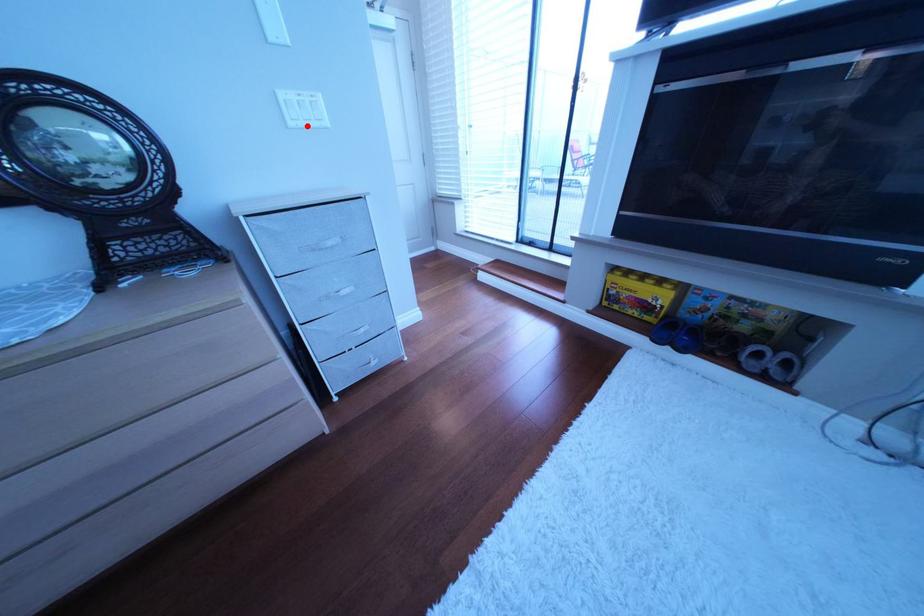
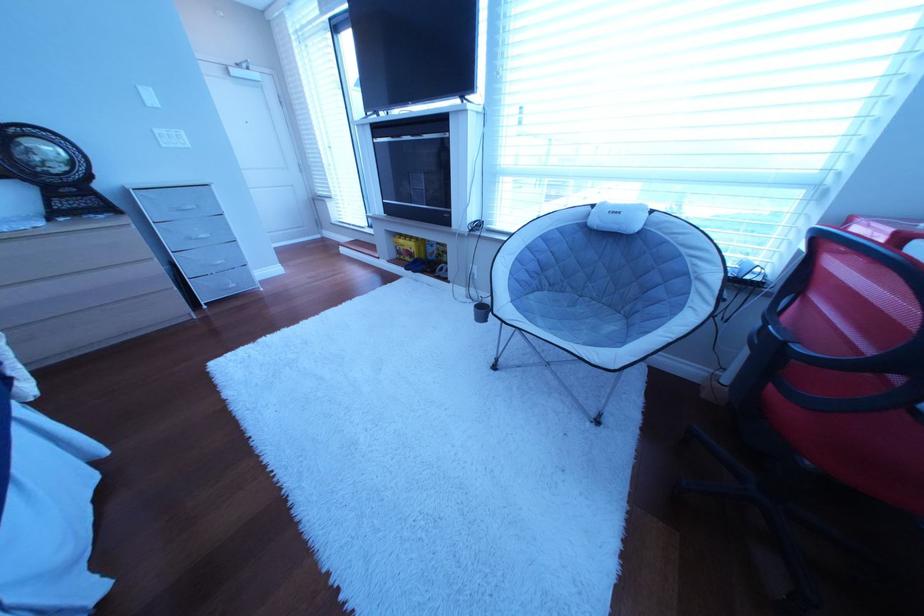
Locate, in the second image, the point that corresponds to the highlighted location in the first image.

(179, 148)